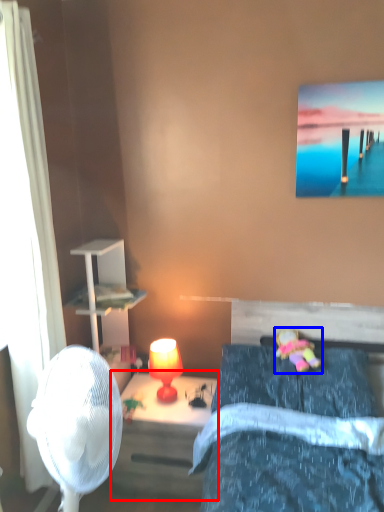
Question: Which point is closer to the camera, nightstand (highlighted by a red box) or toy (highlighted by a blue box)?

Choices:
 (A) nightstand
 (B) toy

Answer: (B)